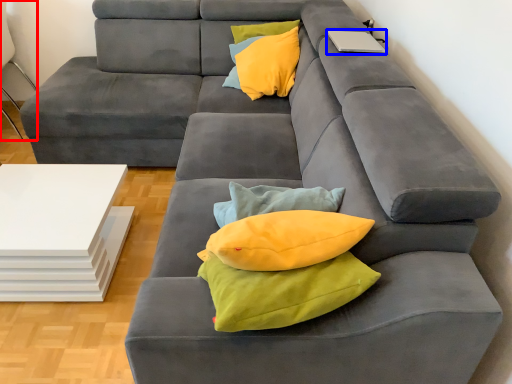
Question: Which object is further to the camera taking this photo, armchair (highlighted by a red box) or laptop (highlighted by a blue box)?

Choices:
 (A) armchair
 (B) laptop

Answer: (A)